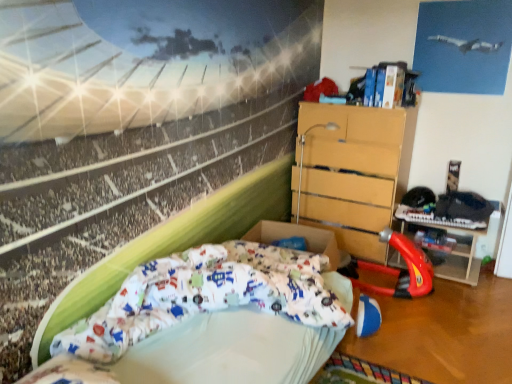
Question: Does rubberized plastic toy at lower right have a greater width compared to white fabric bed at lower left?

Choices:
 (A) no
 (B) yes

Answer: (A)

Question: Can you confirm if rubberized plastic toy at lower right is shorter than white fabric bed at lower left?

Choices:
 (A) no
 (B) yes

Answer: (A)

Question: Does rubberized plastic toy at lower right have a lesser width compared to white fabric bed at lower left?

Choices:
 (A) yes
 (B) no

Answer: (A)

Question: Does rubberized plastic toy at lower right appear on the left side of white fabric bed at lower left?

Choices:
 (A) yes
 (B) no

Answer: (B)

Question: Is there a large distance between rubberized plastic toy at lower right and white fabric bed at lower left?

Choices:
 (A) no
 (B) yes

Answer: (B)

Question: From a real-world perspective, is white fabric bed at lower left physically located above or below wooden chest of drawers at center-right?

Choices:
 (A) below
 (B) above

Answer: (A)

Question: Is white fabric bed at lower left to the left or to the right of wooden chest of drawers at center-right in the image?

Choices:
 (A) left
 (B) right

Answer: (A)

Question: Is white fabric bed at lower left wider or thinner than wooden chest of drawers at center-right?

Choices:
 (A) thin
 (B) wide

Answer: (B)

Question: Is white fabric bed at lower left taller or shorter than wooden chest of drawers at center-right?

Choices:
 (A) tall
 (B) short

Answer: (B)

Question: Is red plastic toy car at center right bigger or smaller than rubberized plastic toy at lower right?

Choices:
 (A) small
 (B) big

Answer: (B)

Question: Do you think red plastic toy car at center right is within rubberized plastic toy at lower right, or outside of it?

Choices:
 (A) outside
 (B) inside

Answer: (A)

Question: Considering the positions of point (424, 269) and point (460, 279), is point (424, 269) closer or farther from the camera than point (460, 279)?

Choices:
 (A) farther
 (B) closer

Answer: (B)

Question: Considering the positions of red plastic toy car at center right and rubberized plastic toy at lower right in the image, is red plastic toy car at center right wider or thinner than rubberized plastic toy at lower right?

Choices:
 (A) thin
 (B) wide

Answer: (B)

Question: In terms of size, does rubberized plastic toy at lower right appear bigger or smaller than wooden chest of drawers at center-right?

Choices:
 (A) small
 (B) big

Answer: (A)

Question: In terms of height, does rubberized plastic toy at lower right look taller or shorter compared to wooden chest of drawers at center-right?

Choices:
 (A) short
 (B) tall

Answer: (A)